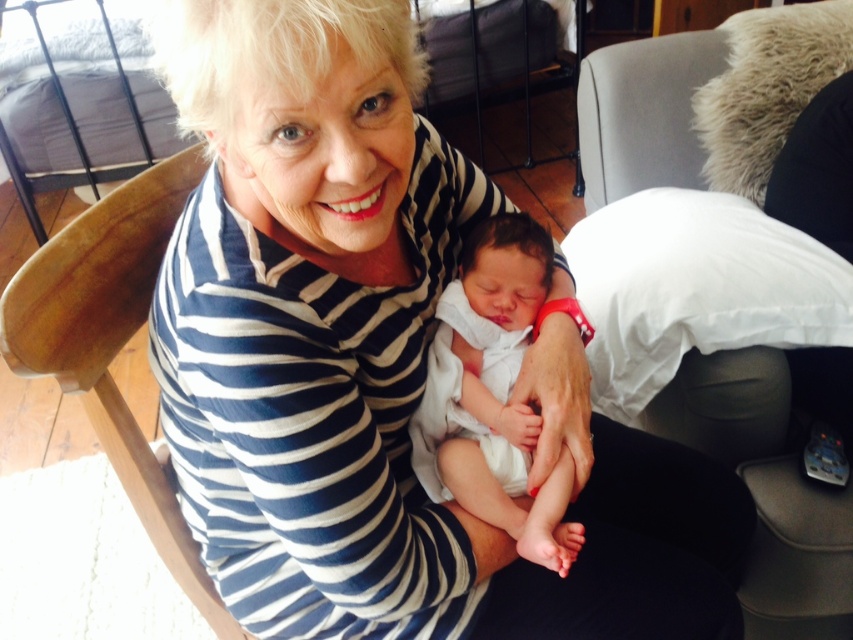
Consider the image. Based on the scene description, can you identify the object located at the coordinates point [380,364]?

The object at point [380,364] is the white striped shirt at center.

You are a photographer setting up for a family portrait. You notice the white striped shirt at center and the white soft cloth at center in the scene. Which object is located to the left of the other?

The white striped shirt at center is positioned on the left side of white soft cloth at center.

You are a photographer setting up for a family portrait. You notice the white striped shirt at center and the white soft cloth at center in the scene. Which item has a greater width when viewed from your camera position?

The white striped shirt at center has a greater width than the white soft cloth at center.